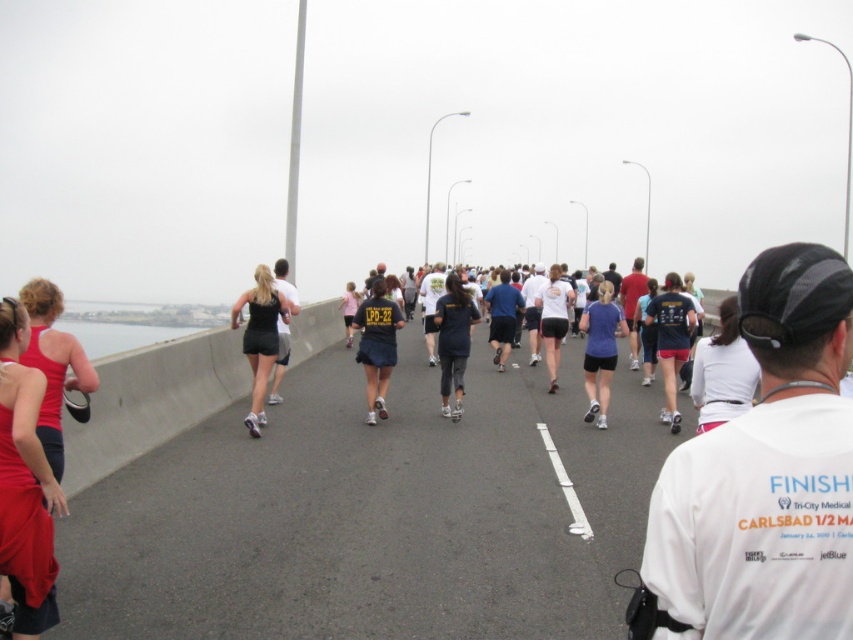
Question: Does dark blue skirt at center lie behind matte black shirt at center?

Choices:
 (A) no
 (B) yes

Answer: (B)

Question: Where is white cotton shirt at center located in relation to matte red tank top at left in the image?

Choices:
 (A) right
 (B) left

Answer: (A)

Question: Which object is positioned farthest from the dark blue skirt at center?

Choices:
 (A) dark blue jersey at center
 (B) matte purple shirt at center
 (C) black matte shorts at center
 (D) matte black shirt at center

Answer: (D)

Question: Considering the relative positions of white cotton shirt at center and matte red tank top at left in the image provided, where is white cotton shirt at center located with respect to matte red tank top at left?

Choices:
 (A) below
 (B) above

Answer: (A)

Question: Which is farther from the matte black shirt at center?

Choices:
 (A) black fabric tank top at center
 (B) white matte tank top at center
 (C) dark blue jersey at center

Answer: (A)

Question: Based on their relative distances, which object is nearer to the black fabric tank top at center?

Choices:
 (A) dark blue skirt at center
 (B) matte purple shirt at center

Answer: (A)